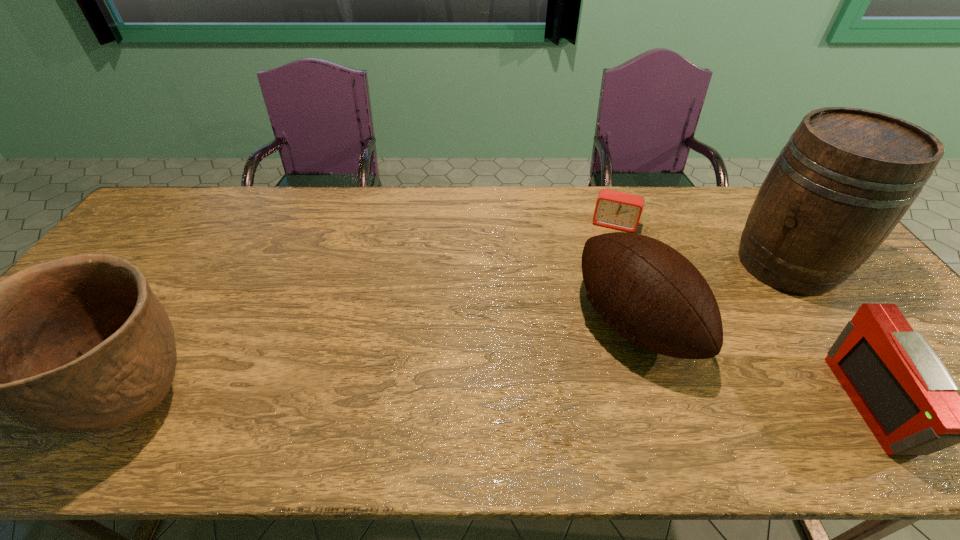
This screenshot has height=540, width=960. In order to click on free space located 0.180m on the laces of the third shortest object in this screenshot , I will do `click(535, 387)`.

This screenshot has height=540, width=960. What are the coordinates of `free space located on the front-facing side of the alarm clock` in the screenshot? It's located at (600, 268).

This screenshot has height=540, width=960. Find the location of `free space located on the front-facing side of the alarm clock`. free space located on the front-facing side of the alarm clock is located at coordinates (602, 262).

Find the location of a particular element. The height and width of the screenshot is (540, 960). vacant space located 0.120m on the front-facing side of the alarm clock is located at coordinates click(603, 258).

Locate an element on the screen. vacant space situated 0.370m on the side of the tallest object near the bung hole is located at coordinates (661, 340).

At what (x,y) coordinates should I click in order to perform the action: click on blank space located on the side of the tallest object near the bung hole. Please return your answer as a coordinate pair (x, y). Looking at the image, I should click on (691, 322).

Find the location of a particular element. This screenshot has height=540, width=960. vacant space located 0.370m on the side of the tallest object near the bung hole is located at coordinates coord(661,340).

Locate an element on the screen. object that is at the far edge is located at coordinates (618, 210).

Image resolution: width=960 pixels, height=540 pixels. Find the location of `pottery located in the near edge section of the desktop`. pottery located in the near edge section of the desktop is located at coordinates (80, 344).

Identify the location of camera that is at the near edge. (908, 398).